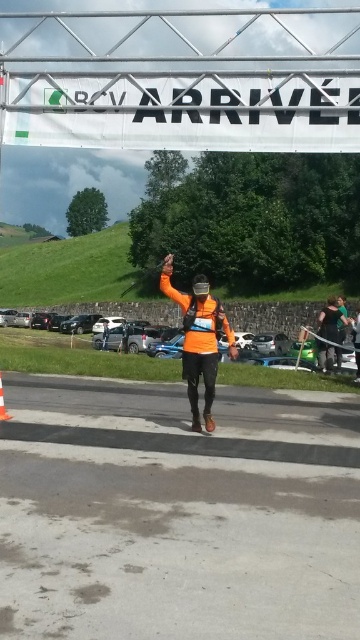
Who is positioned more to the left, orange matte safety vest at center or orange plastic traffic cone at center?

From the viewer's perspective, orange plastic traffic cone at center appears more on the left side.

You are a GUI agent. You are given a task and a screenshot of the screen. Output one action in this format:
    pyautogui.click(x=<x>, y=<y>)
    Task: Click on the orange matte safety vest at center
    The height and width of the screenshot is (640, 360).
    Given the screenshot: What is the action you would take?
    pyautogui.click(x=200, y=323)

Image resolution: width=360 pixels, height=640 pixels. Find the location of `orange matte safety vest at center`. orange matte safety vest at center is located at coordinates (200, 323).

Does smooth asphalt road at center have a larger size compared to orange matte running suit at center?

No, smooth asphalt road at center is not bigger than orange matte running suit at center.

Who is more forward, [137,435] or [189,314]?

Point [137,435] is in front.

The width and height of the screenshot is (360, 640). What are the coordinates of `smooth asphalt road at center` in the screenshot? It's located at (177, 513).

Does smooth asphalt road at center have a greater width compared to orange matte safety vest at center?

Indeed, smooth asphalt road at center has a greater width compared to orange matte safety vest at center.

The width and height of the screenshot is (360, 640). In order to click on smooth asphalt road at center in this screenshot , I will do `click(177, 513)`.

The height and width of the screenshot is (640, 360). What are the coordinates of `smooth asphalt road at center` in the screenshot? It's located at (177, 513).